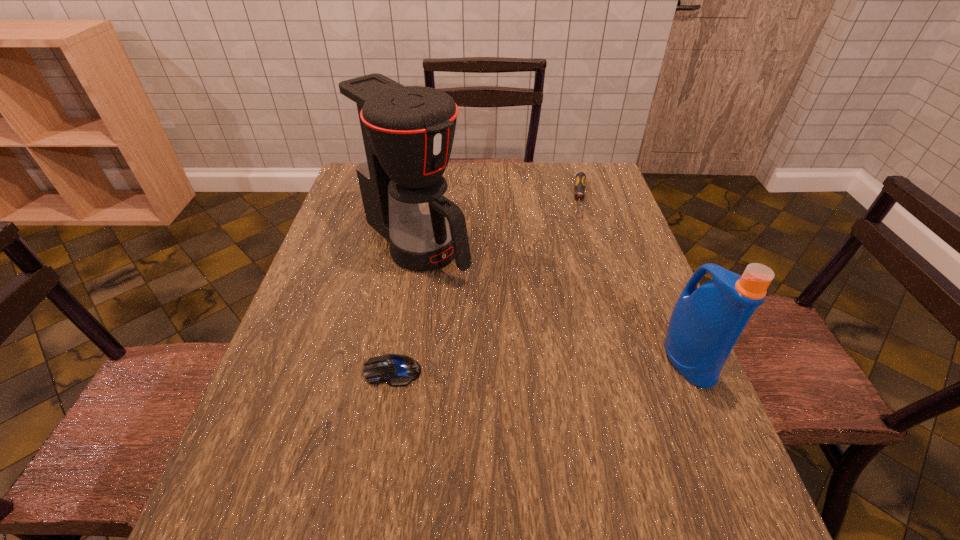
In order to click on vacant space on the desktop that is between the computer mouse and the rightmost object and is positioned pour from the carafe of the tallest object in this screenshot , I will do `click(558, 364)`.

At what (x,y) coordinates should I click in order to perform the action: click on free spot on the desktop that is between the computer mouse and the rightmost object and is positioned insert the second object from right to left into a screw head. Please return your answer as a coordinate pair (x, y). Looking at the image, I should click on (569, 364).